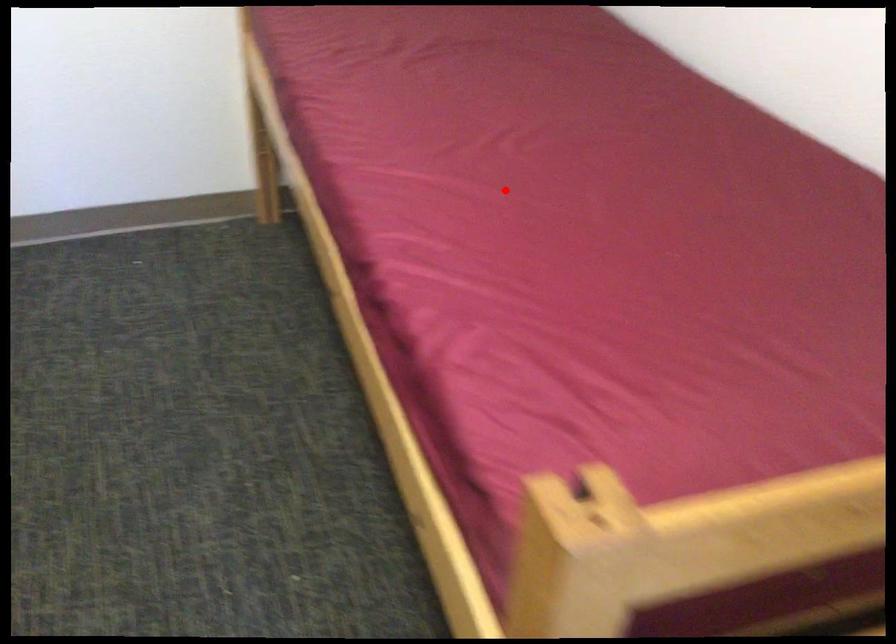
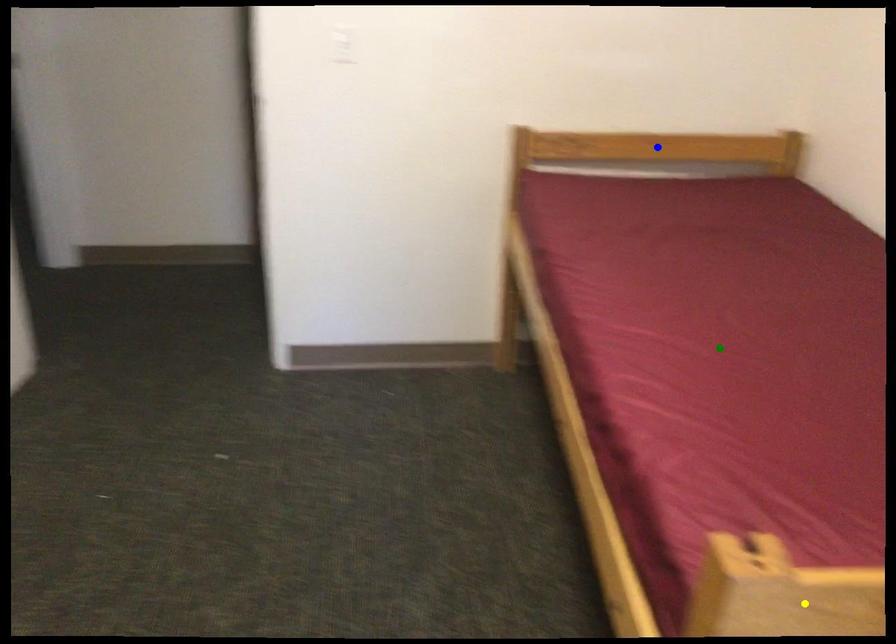
Question: I am providing you with two images of the same scene from different viewpoints. A red point is marked on the first image. You are given multiple points on the second image. Which point in image 2 represents the same 3d spot as the red point in image 1?

Choices:
 (A) green point
 (B) blue point
 (C) yellow point

Answer: (A)